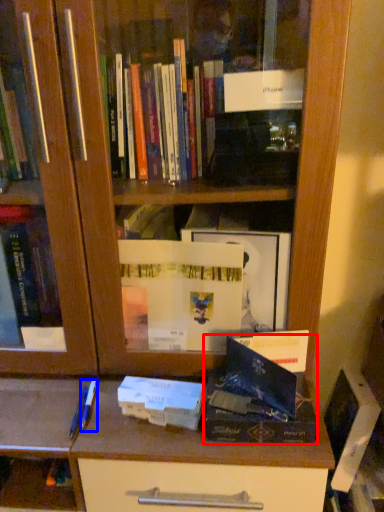
Question: Which point is further to the camera, paperback book (highlighted by a red box) or pen (highlighted by a blue box)?

Choices:
 (A) paperback book
 (B) pen

Answer: (B)